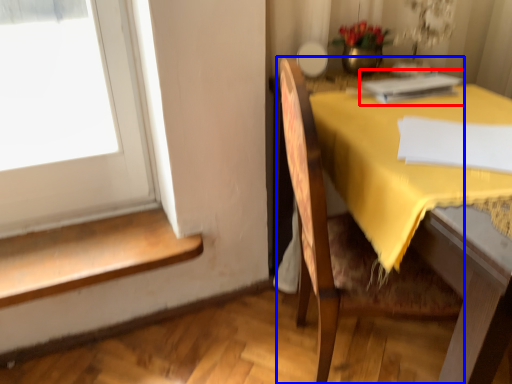
Question: Which of the following is the farthest to the observer, book (highlighted by a red box) or chair (highlighted by a blue box)?

Choices:
 (A) book
 (B) chair

Answer: (A)